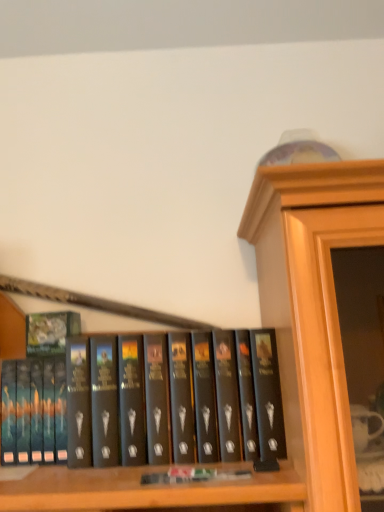
Question: Considering the relative sizes of green matte book at left and black matte book at center in the image provided, is green matte book at left smaller than black matte book at center?

Choices:
 (A) yes
 (B) no

Answer: (A)

Question: Can you confirm if green matte book at left is positioned to the left of black matte book at center?

Choices:
 (A) no
 (B) yes

Answer: (B)

Question: Is green matte book at left at the right side of black matte book at center?

Choices:
 (A) yes
 (B) no

Answer: (B)

Question: Is black matte book at center a part of green matte book at left?

Choices:
 (A) yes
 (B) no

Answer: (B)

Question: Considering the relative sizes of green matte book at left and black matte book at center in the image provided, is green matte book at left thinner than black matte book at center?

Choices:
 (A) no
 (B) yes

Answer: (B)

Question: Considering the relative sizes of green matte book at left and black matte book at center in the image provided, is green matte book at left bigger than black matte book at center?

Choices:
 (A) no
 (B) yes

Answer: (A)

Question: Is black matte book at center positioned before green matte book at left?

Choices:
 (A) no
 (B) yes

Answer: (B)

Question: From a real-world perspective, does black matte book at center stand above green matte book at left?

Choices:
 (A) no
 (B) yes

Answer: (A)

Question: Does black matte book at center have a greater width compared to green matte book at left?

Choices:
 (A) yes
 (B) no

Answer: (A)

Question: Is black matte book at center at the left side of green matte book at left?

Choices:
 (A) no
 (B) yes

Answer: (A)

Question: Is black matte book at center to the right of green matte book at left from the viewer's perspective?

Choices:
 (A) no
 (B) yes

Answer: (B)

Question: Can you confirm if black matte book at center is smaller than green matte book at left?

Choices:
 (A) yes
 (B) no

Answer: (B)

Question: Considering the positions of black matte book at center and green matte book at left in the image, is black matte book at center wider or thinner than green matte book at left?

Choices:
 (A) thin
 (B) wide

Answer: (B)